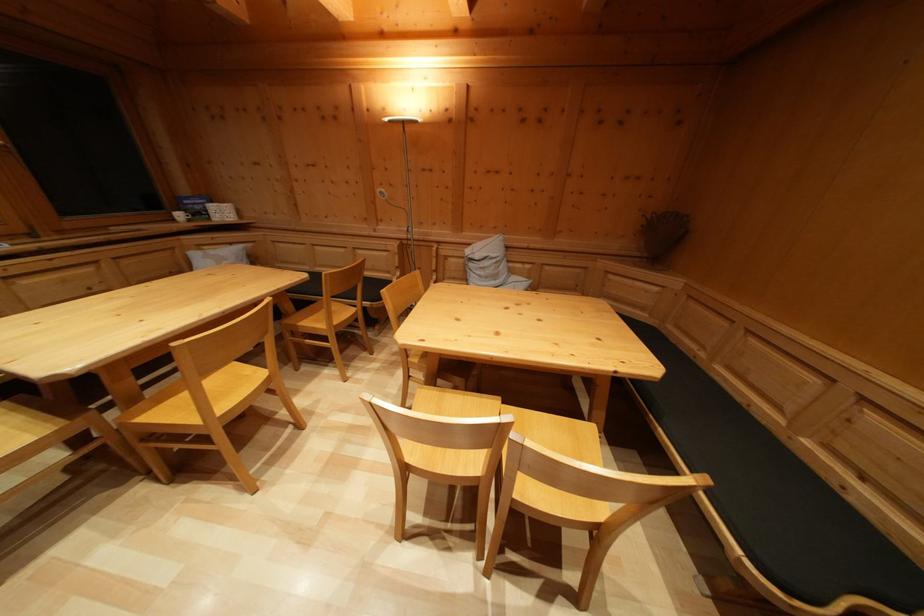
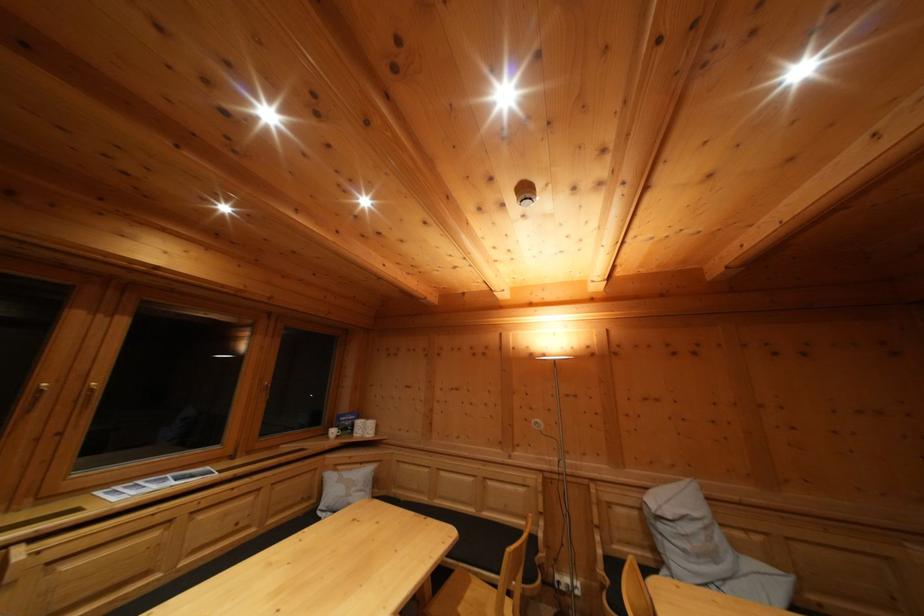
Locate, in the second image, the point that corresponds to (x=237, y=251) in the first image.

(368, 469)